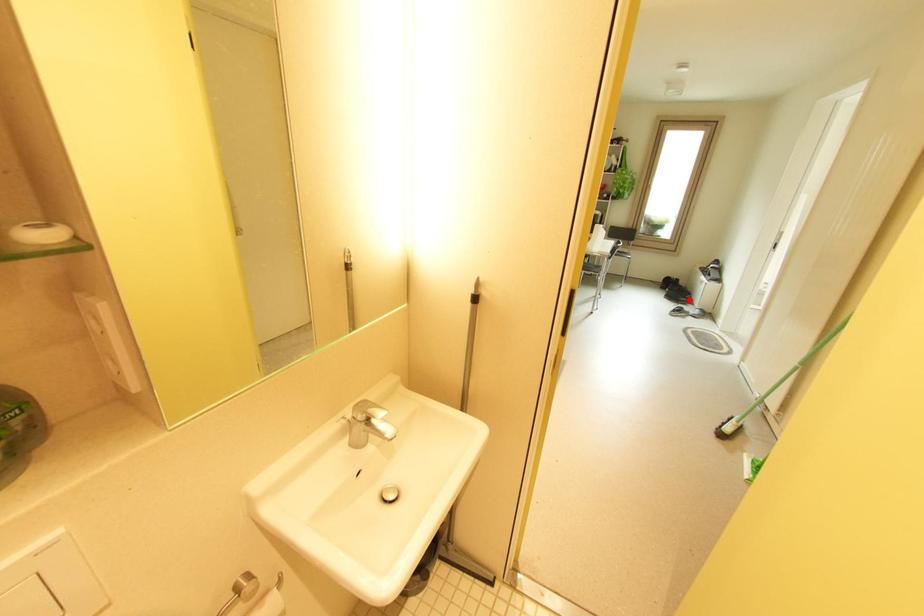
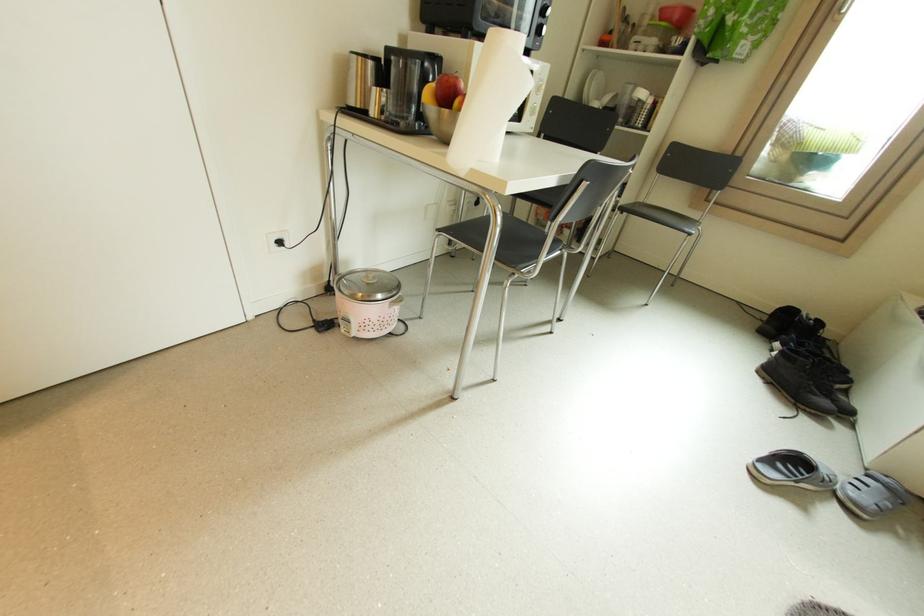
Question: I am providing you with two images of the same scene from different viewpoints. In image1, a red point is highlighted. Considering the same 3D point in image2, which of the following is correct?

Choices:
 (A) It is closer
 (B) It is farther

Answer: (B)